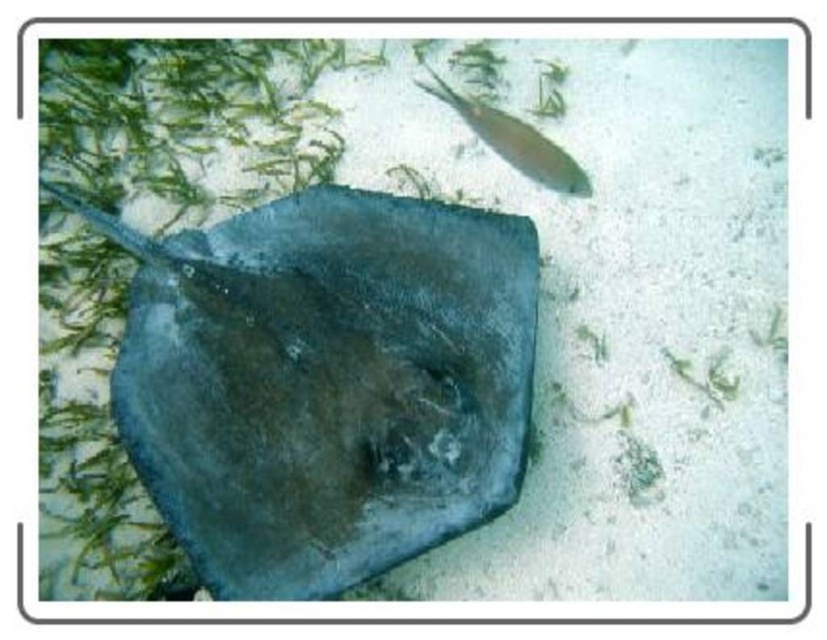
Question: Can you confirm if dark blue leather stingray at center is positioned below shiny silver fish at upper right?

Choices:
 (A) yes
 (B) no

Answer: (A)

Question: Which of the following is the closest to the observer?

Choices:
 (A) (547, 168)
 (B) (134, 292)

Answer: (B)

Question: Does dark blue leather stingray at center come in front of shiny silver fish at upper right?

Choices:
 (A) no
 (B) yes

Answer: (B)

Question: Does dark blue leather stingray at center appear under shiny silver fish at upper right?

Choices:
 (A) yes
 (B) no

Answer: (A)